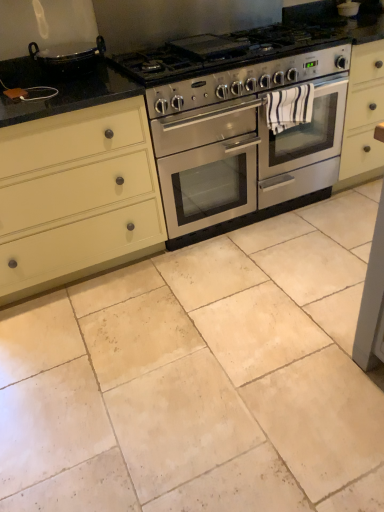
Where is `free space above beige stone tile at center (from a real-world perspective)`? This screenshot has height=512, width=384. free space above beige stone tile at center (from a real-world perspective) is located at coordinates (199, 324).